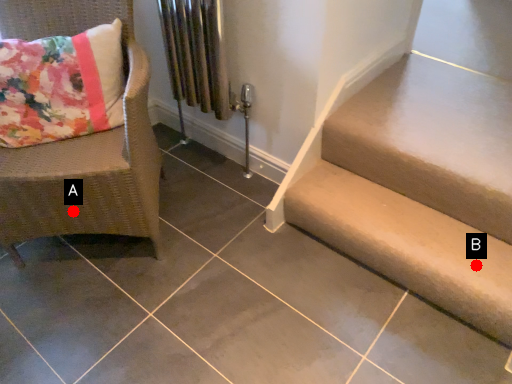
Question: Two points are circled on the image, labeled by A and B beside each circle. Which of the following is the farthest from the observer?

Choices:
 (A) A is further
 (B) B is further

Answer: (A)